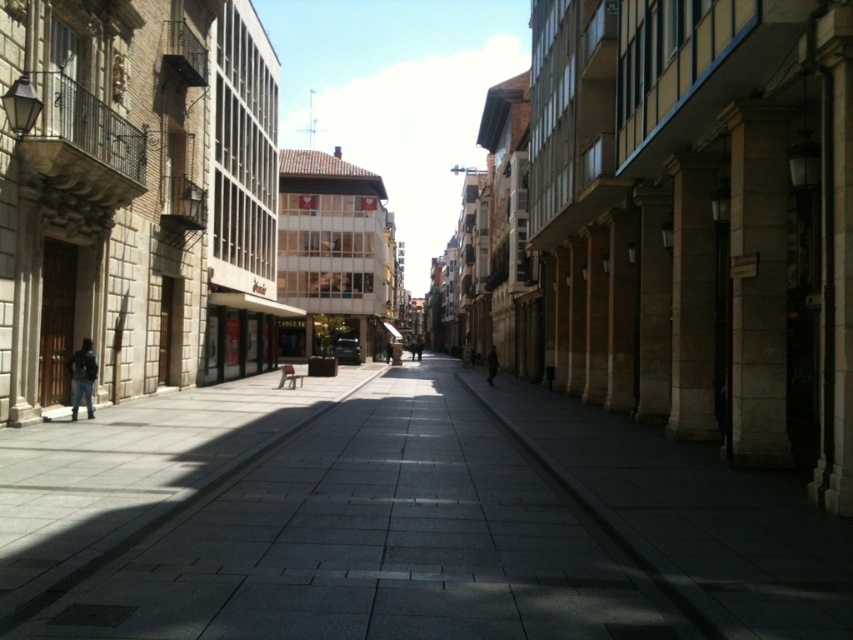
Question: Which point is closer to the camera?

Choices:
 (A) (492, 376)
 (B) (77, 360)
 (C) (314, 637)

Answer: (C)

Question: Can you confirm if gray stone pavement at center is positioned below dark blue jacket at left?

Choices:
 (A) yes
 (B) no

Answer: (A)

Question: Is gray stone pavement at center above brown wool coat at center?

Choices:
 (A) no
 (B) yes

Answer: (B)

Question: Which point appears closest to the camera in this image?

Choices:
 (A) (74, 413)
 (B) (831, 592)

Answer: (B)

Question: Among these points, which one is nearest to the camera?

Choices:
 (A) (492, 344)
 (B) (175, 561)

Answer: (B)

Question: Is dark blue jacket at left smaller than brown wool coat at center?

Choices:
 (A) no
 (B) yes

Answer: (B)